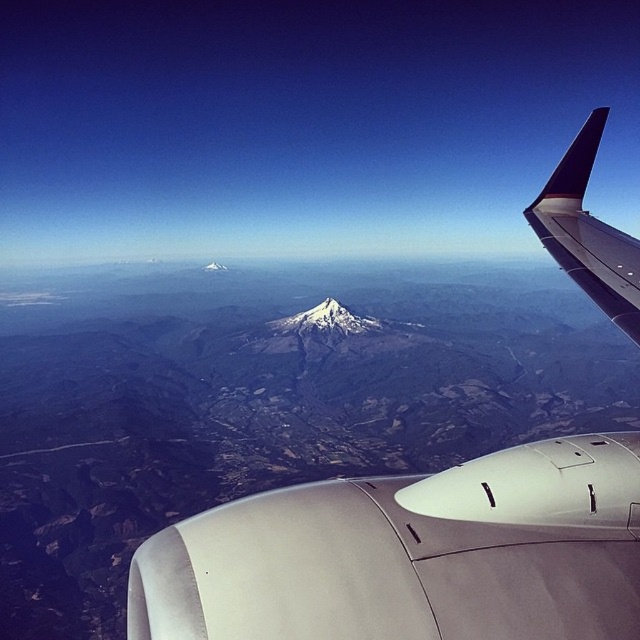
Question: Is white matte engine at center thinner than dark blue matte winglet at upper right?

Choices:
 (A) yes
 (B) no

Answer: (A)

Question: Can you confirm if white matte engine at center is positioned to the right of dark blue matte winglet at upper right?

Choices:
 (A) no
 (B) yes

Answer: (A)

Question: Which point appears closest to the camera in this image?

Choices:
 (A) (588, 284)
 (B) (604, 268)

Answer: (A)

Question: Where is white matte engine at center located in relation to dark blue matte winglet at upper right in the image?

Choices:
 (A) left
 (B) right

Answer: (A)

Question: Which object appears closest to the camera in this image?

Choices:
 (A) dark blue matte winglet at upper right
 (B) white matte engine at center

Answer: (B)